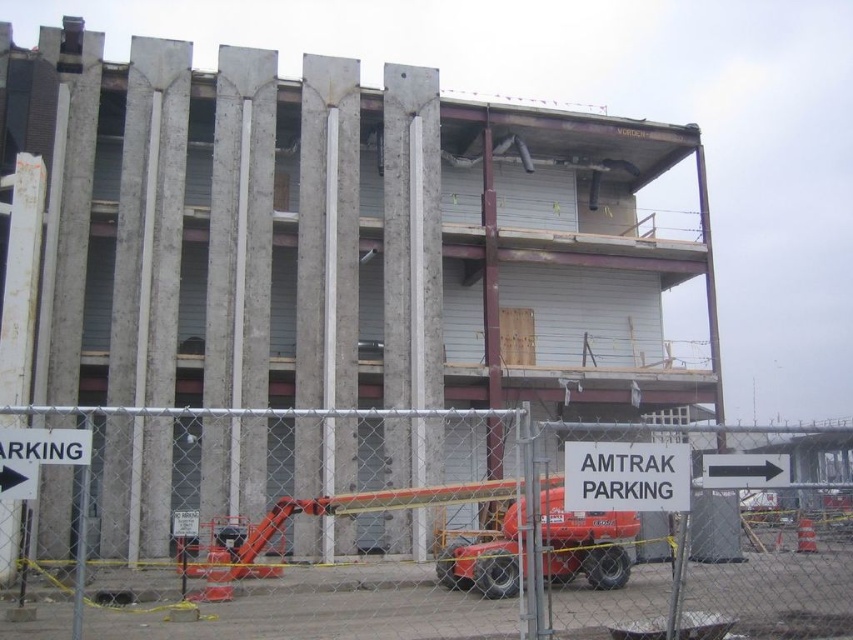
Question: Is white plastic sign at center below black arrow at right?

Choices:
 (A) no
 (B) yes

Answer: (B)

Question: Is orange rubber lift at lower center to the right of white plastic sign at center from the viewer's perspective?

Choices:
 (A) no
 (B) yes

Answer: (A)

Question: Considering the real-world distances, which object is farthest from the black arrow at right?

Choices:
 (A) white plastic sign at center
 (B) orange rubber lift at lower center

Answer: (B)

Question: Which object is closer to the camera taking this photo?

Choices:
 (A) black arrow at right
 (B) white plastic sign at center
 (C) orange rubber lift at lower center

Answer: (C)

Question: Is white plastic sign at center in front of black arrow at right?

Choices:
 (A) no
 (B) yes

Answer: (B)

Question: Estimate the real-world distances between objects in this image. Which object is farther from the black arrow at right?

Choices:
 (A) white plastic sign at center
 (B) orange rubber lift at lower center

Answer: (B)